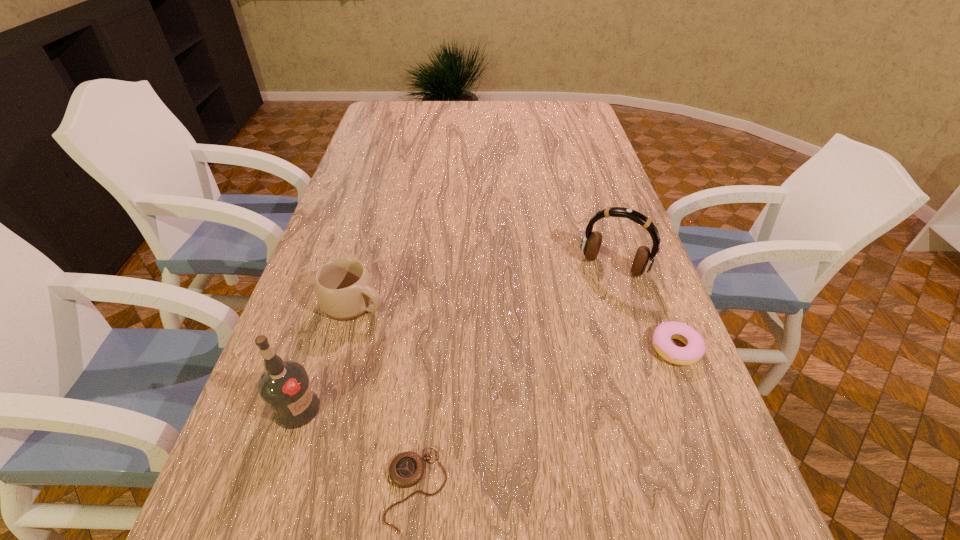
Identify the location of the shortest object. This screenshot has height=540, width=960. (406, 469).

Locate an element on the screen. pocket watch is located at coordinates (406, 469).

Find the location of a particular element. doughnut is located at coordinates (694, 349).

Where is `the third nearest object`? the third nearest object is located at coordinates (694, 349).

This screenshot has width=960, height=540. Find the location of `the third tallest object`. the third tallest object is located at coordinates (344, 289).

The image size is (960, 540). What are the coordinates of `the second farthest object` in the screenshot? It's located at (344, 289).

The image size is (960, 540). In order to click on the tallest object in this screenshot , I will do `click(285, 387)`.

This screenshot has height=540, width=960. In order to click on the second nearest object in this screenshot , I will do `click(285, 387)`.

You are a GUI agent. You are given a task and a screenshot of the screen. Output one action in this format:
    pyautogui.click(x=<x>, y=<y>)
    Task: Click on the second tallest object
    
    Given the screenshot: What is the action you would take?
    pyautogui.click(x=590, y=245)

Find the location of a particular element. headset is located at coordinates (590, 245).